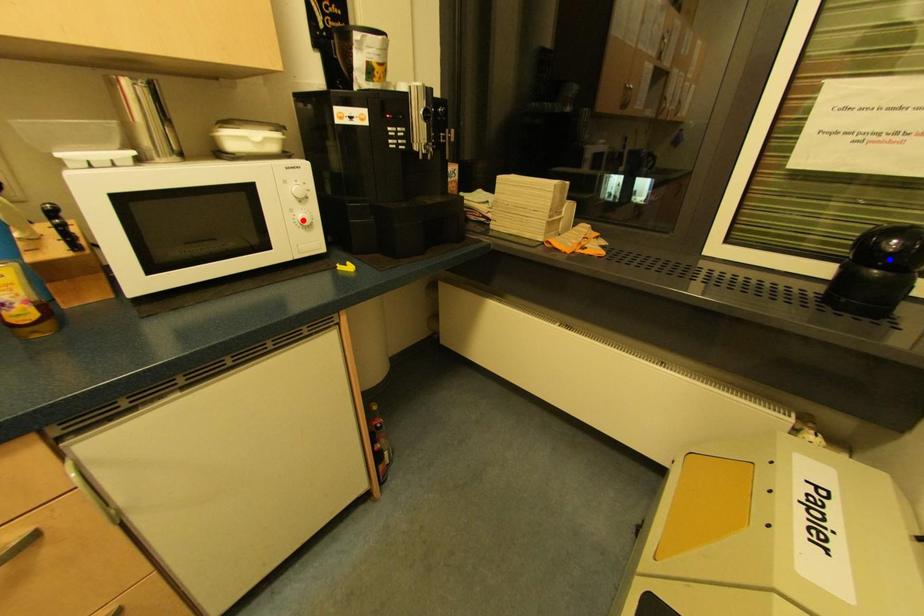
Question: Which of the two points in the image is closer to the camera?

Choices:
 (A) Blue point is closer.
 (B) Red point is closer.

Answer: (A)